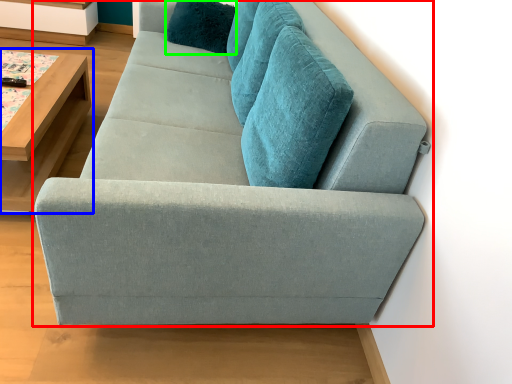
Question: Which object is the farthest from studio couch (highlighted by a red box)? Choose among these: table (highlighted by a blue box) or pillow (highlighted by a green box).

Choices:
 (A) table
 (B) pillow

Answer: (B)